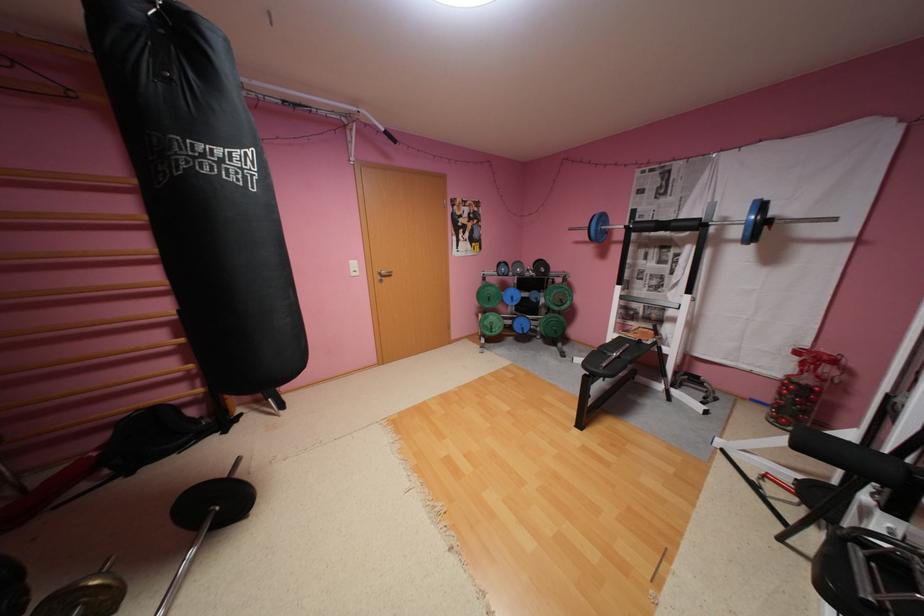
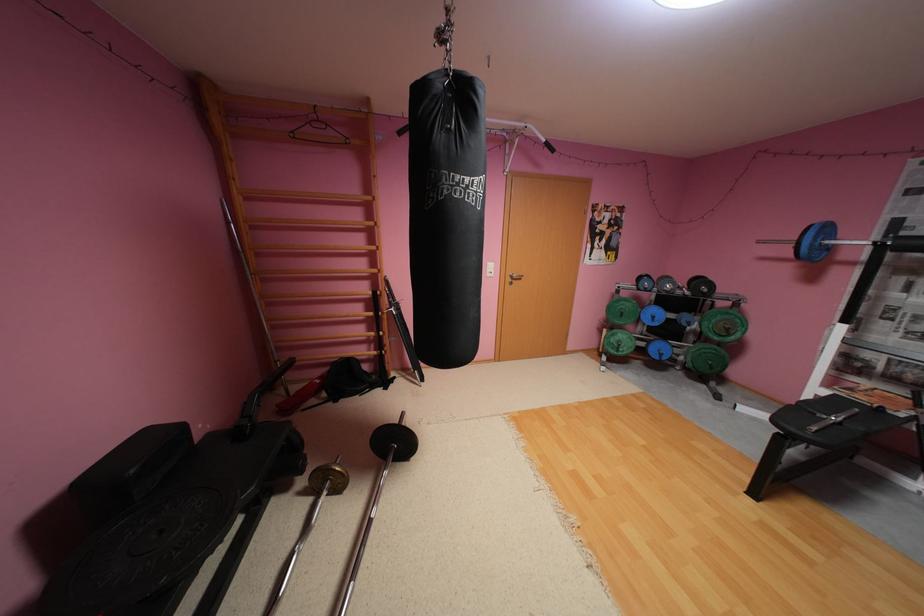
In the second image, find the point that corresponds to (658,342) in the first image.

(909, 415)